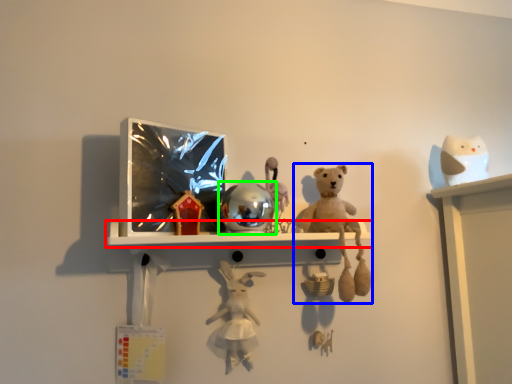
Question: Which is nearer to the shelf (highlighted by a red box)? toy (highlighted by a blue box) or toy (highlighted by a green box).

Choices:
 (A) toy
 (B) toy

Answer: (B)